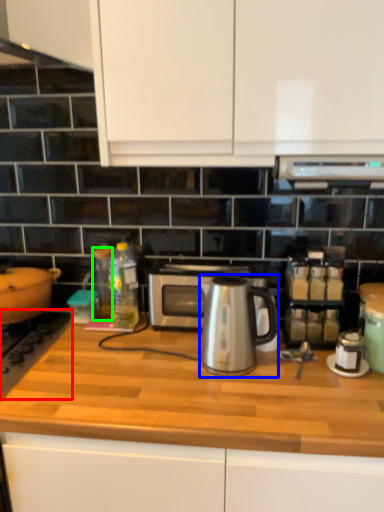
Question: Considering the real-world distances, which object is farthest from gas stove (highlighted by a red box)? coffeepot (highlighted by a blue box) or bottle (highlighted by a green box)?

Choices:
 (A) coffeepot
 (B) bottle

Answer: (A)